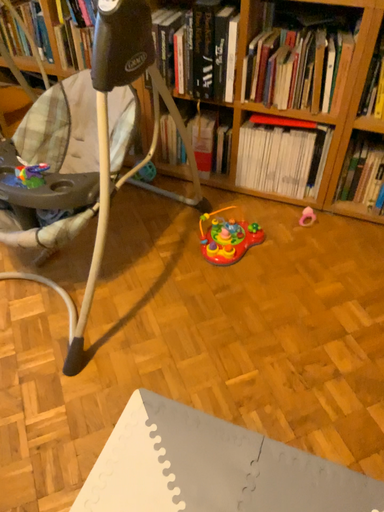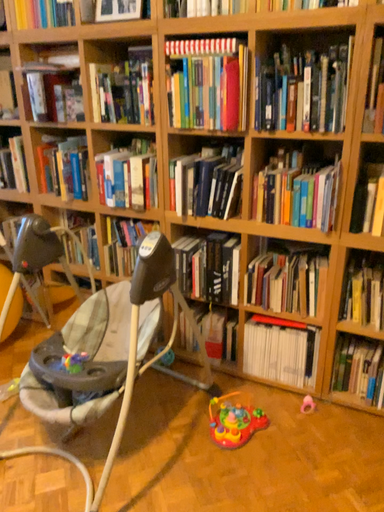
Question: How did the camera likely rotate when shooting the video?

Choices:
 (A) rotated downward
 (B) rotated upward

Answer: (B)